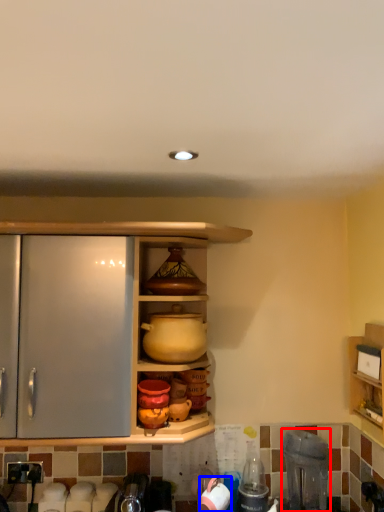
Question: Which point is further to the camera, appliance (highlighted by a red box) or appliance (highlighted by a blue box)?

Choices:
 (A) appliance
 (B) appliance

Answer: (B)